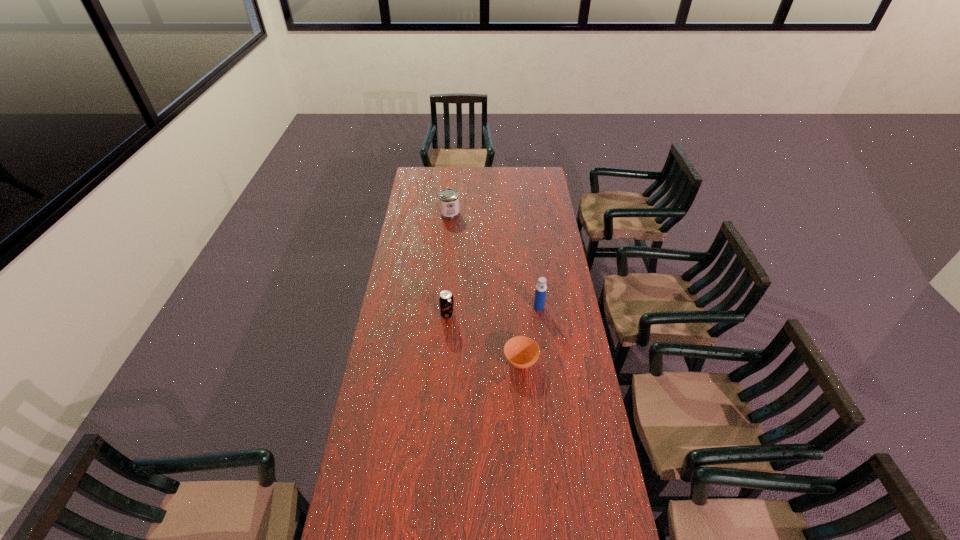
Where is `the rightmost object`? This screenshot has width=960, height=540. the rightmost object is located at coordinates (541, 288).

At what (x,y) coordinates should I click in order to perform the action: click on the tallest object. Please return your answer as a coordinate pair (x, y). This screenshot has height=540, width=960. Looking at the image, I should click on pos(541,288).

Find the location of a particular element. The image size is (960, 540). soda can is located at coordinates (446, 299).

This screenshot has height=540, width=960. In order to click on can in this screenshot , I will do `click(448, 198)`.

This screenshot has height=540, width=960. I want to click on the third object from left to right, so click(522, 352).

Where is `the shortest object`? This screenshot has width=960, height=540. the shortest object is located at coordinates (522, 352).

This screenshot has width=960, height=540. Identify the location of free region located on the back of the tallest object. (534, 271).

The height and width of the screenshot is (540, 960). In order to click on vacant position located on the back of the soda can in this screenshot , I will do `click(449, 285)`.

Image resolution: width=960 pixels, height=540 pixels. I want to click on free space located 0.190m on the front of the farthest object, so click(x=447, y=240).

This screenshot has width=960, height=540. Identify the location of vacant space located on the front of the soup bowl. (524, 402).